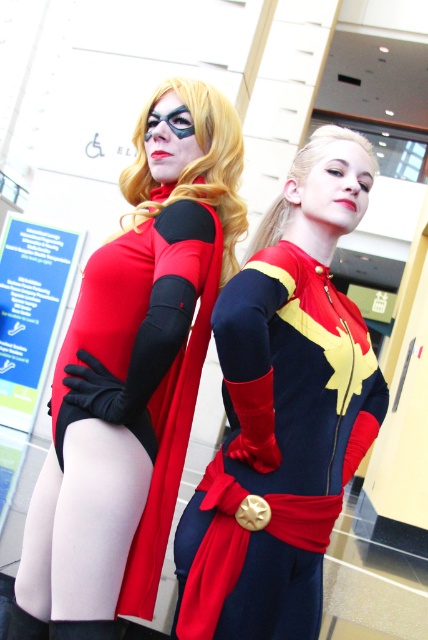
Question: Can you confirm if matte black bodysuit at left is smaller than matte red cape at center?

Choices:
 (A) yes
 (B) no

Answer: (A)

Question: Where is matte black bodysuit at left located in relation to matte red cape at center in the image?

Choices:
 (A) above
 (B) below

Answer: (A)

Question: Among these points, which one is farthest from the camera?

Choices:
 (A) (201, 602)
 (B) (166, 378)

Answer: (B)

Question: Does matte black bodysuit at left have a larger size compared to matte red cape at center?

Choices:
 (A) yes
 (B) no

Answer: (B)